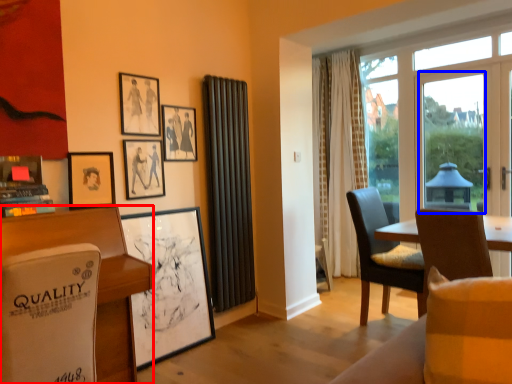
Question: Which object appears closest to the camera in this image, desk (highlighted by a red box) or window screen (highlighted by a blue box)?

Choices:
 (A) desk
 (B) window screen

Answer: (A)